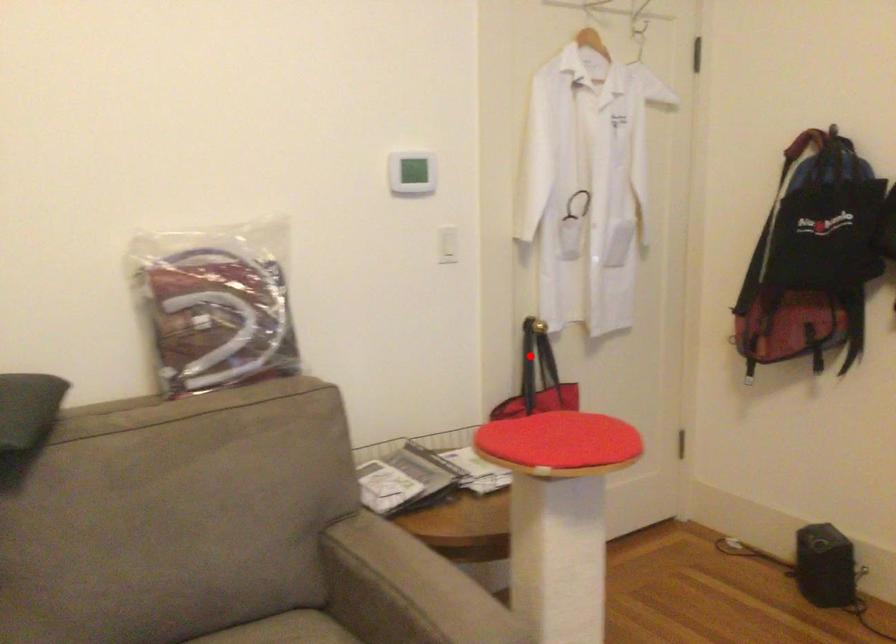
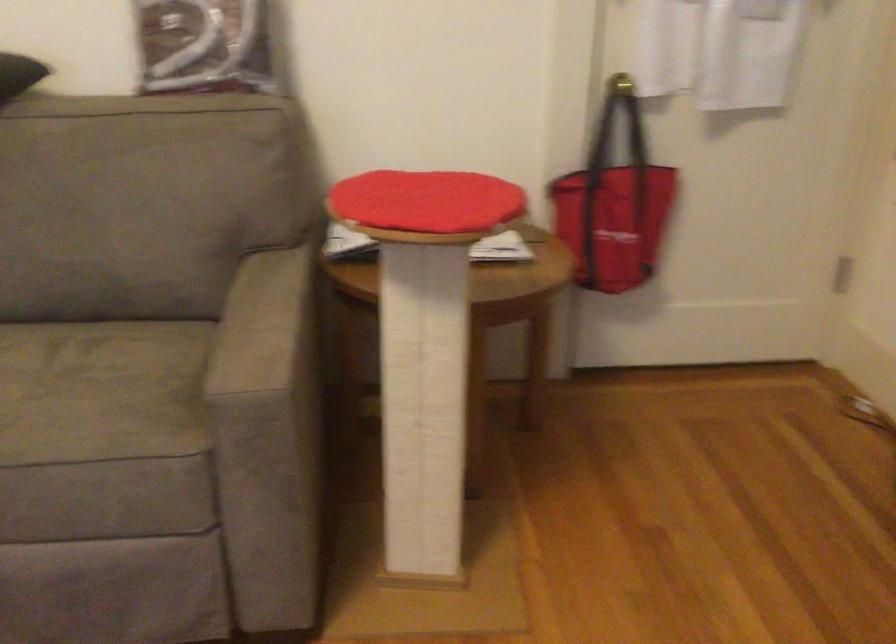
Find the pixel in the second image that matches the highlighted location in the first image.

(616, 124)